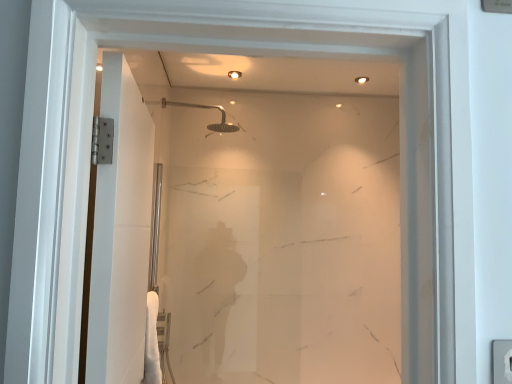
Question: Can you confirm if clear glass screen door at left is smaller than matte silver shower head at upper center?

Choices:
 (A) yes
 (B) no

Answer: (B)

Question: Is clear glass screen door at left not near matte silver shower head at upper center?

Choices:
 (A) no
 (B) yes

Answer: (B)

Question: Could you tell me if clear glass screen door at left is facing matte silver shower head at upper center?

Choices:
 (A) no
 (B) yes

Answer: (A)

Question: From a real-world perspective, does clear glass screen door at left sit lower than matte silver shower head at upper center?

Choices:
 (A) yes
 (B) no

Answer: (A)

Question: Is clear glass screen door at left at the right side of matte silver shower head at upper center?

Choices:
 (A) yes
 (B) no

Answer: (B)

Question: Is matte silver shower head at upper center at the back of clear glass screen door at left?

Choices:
 (A) no
 (B) yes

Answer: (A)

Question: From a real-world perspective, is matte silver shower head at upper center below clear glass screen door at left?

Choices:
 (A) no
 (B) yes

Answer: (A)

Question: Is the position of matte silver shower head at upper center less distant than that of clear glass screen door at left?

Choices:
 (A) no
 (B) yes

Answer: (A)

Question: Is matte silver shower head at upper center facing away from clear glass screen door at left?

Choices:
 (A) no
 (B) yes

Answer: (A)

Question: Does matte silver shower head at upper center have a lesser width compared to clear glass screen door at left?

Choices:
 (A) no
 (B) yes

Answer: (A)

Question: Considering the relative positions of matte silver shower head at upper center and clear glass screen door at left in the image provided, is matte silver shower head at upper center to the right of clear glass screen door at left from the viewer's perspective?

Choices:
 (A) yes
 (B) no

Answer: (A)

Question: Is matte silver shower head at upper center facing towards clear glass screen door at left?

Choices:
 (A) no
 (B) yes

Answer: (A)

Question: Is clear glass screen door at left taller or shorter than matte silver shower head at upper center?

Choices:
 (A) short
 (B) tall

Answer: (B)